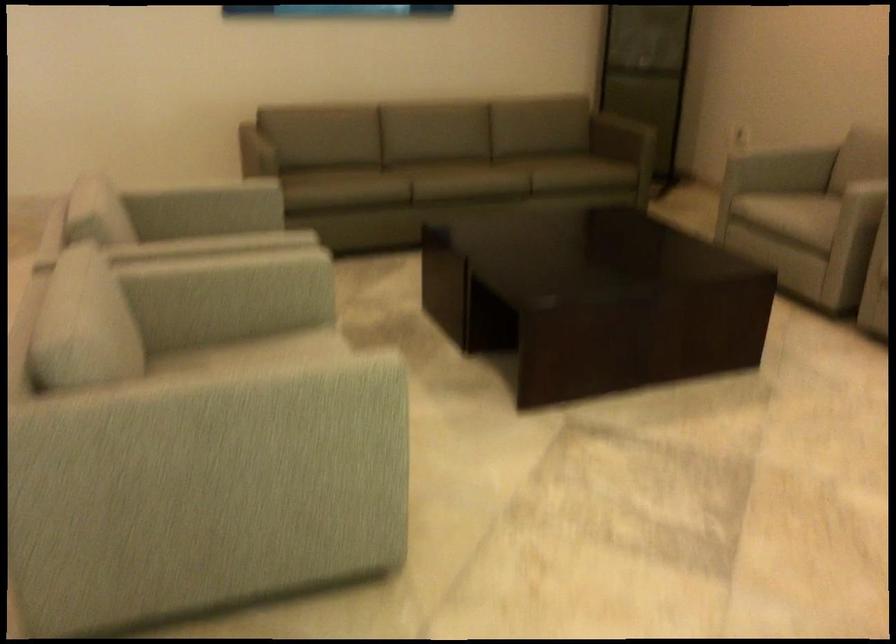
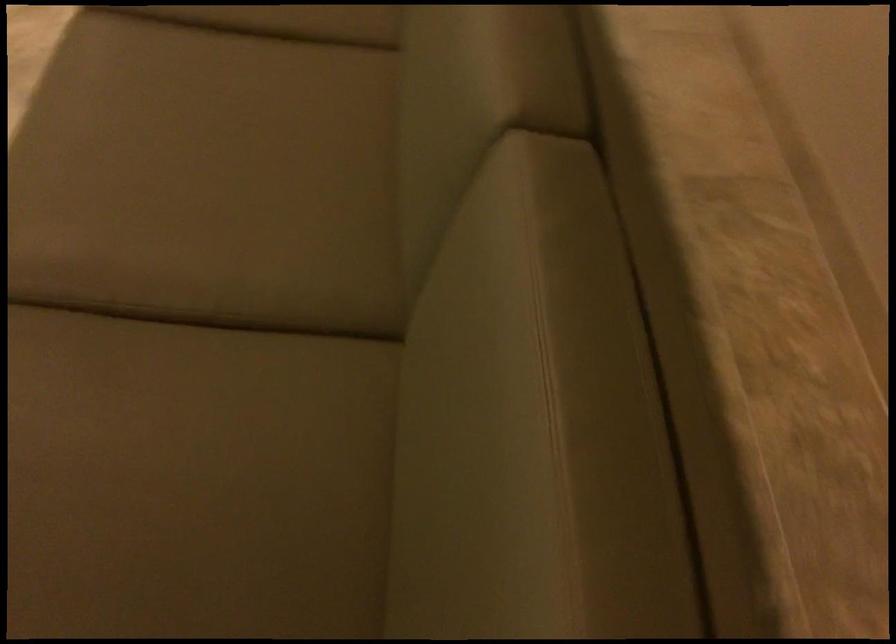
The point at (355, 172) is marked in the first image. Where is the corresponding point in the second image?

(286, 20)